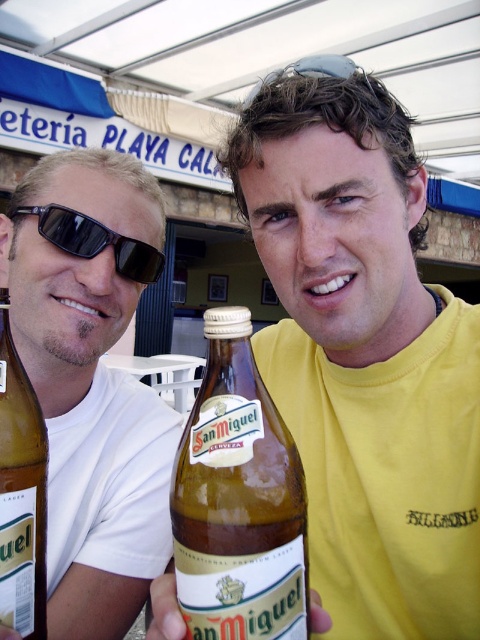
Is black plastic sunglasses at left in front of sunglasses at center?

No, black plastic sunglasses at left is behind sunglasses at center.

Who is more forward, (17, 216) or (369, 86)?

Point (369, 86) is more forward.

Which is behind, point (137, 266) or point (372, 92)?

The point (137, 266) is more distant.

At what (x,y) coordinates should I click in order to perform the action: click on black plastic sunglasses at left. Please return your answer as a coordinate pair (x, y). Looking at the image, I should click on (95, 241).

The height and width of the screenshot is (640, 480). I want to click on brown glass bottle at center, so click(x=238, y=500).

Is brown glass bottle at center below black plastic sunglasses at left?

Yes, brown glass bottle at center is below black plastic sunglasses at left.

Describe the element at coordinates (238, 500) in the screenshot. This screenshot has width=480, height=640. I see `brown glass bottle at center` at that location.

Locate an element on the screen. The height and width of the screenshot is (640, 480). brown glass bottle at center is located at coordinates (238, 500).

Based on the photo, can you confirm if matte white shirt at center is wider than black plastic sunglasses at left?

Yes, matte white shirt at center is wider than black plastic sunglasses at left.

Describe the element at coordinates (92, 380) in the screenshot. This screenshot has width=480, height=640. I see `matte white shirt at center` at that location.

Image resolution: width=480 pixels, height=640 pixels. I want to click on matte white shirt at center, so click(x=92, y=380).